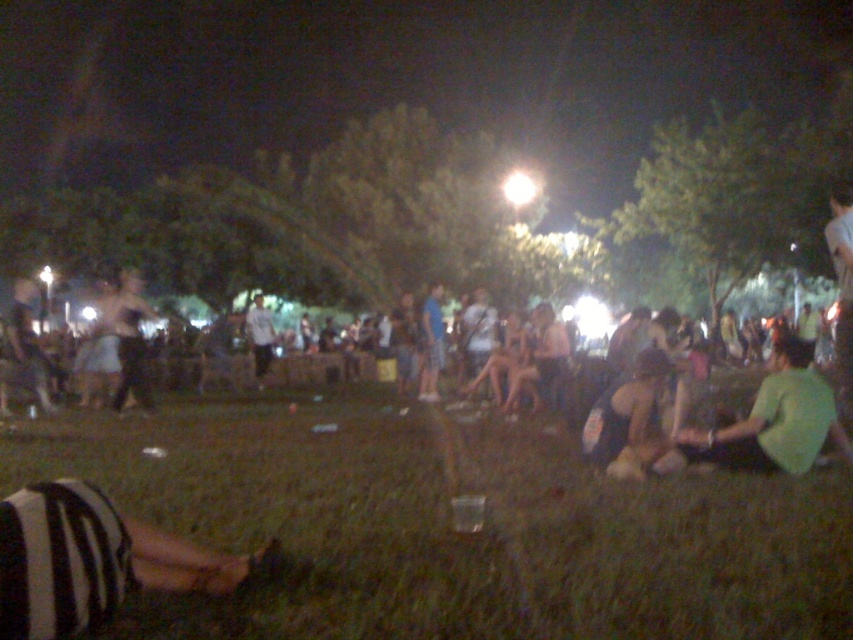
Does green grass at lower center have a lesser width compared to striped fabric leg at lower left?

In fact, green grass at lower center might be wider than striped fabric leg at lower left.

Between green grass at lower center and striped fabric leg at lower left, which one has less height?

With less height is green grass at lower center.

This screenshot has width=853, height=640. What are the coordinates of `green grass at lower center` in the screenshot? It's located at (451, 525).

Where is `green grass at lower center`? green grass at lower center is located at coordinates (451, 525).

How far apart are green matte shirt at lower right and dark green fabric at lower right?

green matte shirt at lower right and dark green fabric at lower right are 32.37 inches apart.

Between green matte shirt at lower right and dark green fabric at lower right, which one has less height?

green matte shirt at lower right

Who is more forward, (791, 353) or (622, 413)?

Positioned in front is point (791, 353).

Find the location of `green matte shirt at lower right`. green matte shirt at lower right is located at coordinates (775, 420).

Between point (387, 365) and point (778, 468), which one is positioned behind?

Point (387, 365)

Is point (259, 300) farther from viewer compared to point (770, 465)?

That is True.

The width and height of the screenshot is (853, 640). I want to click on dark clothing crowd at center, so click(706, 429).